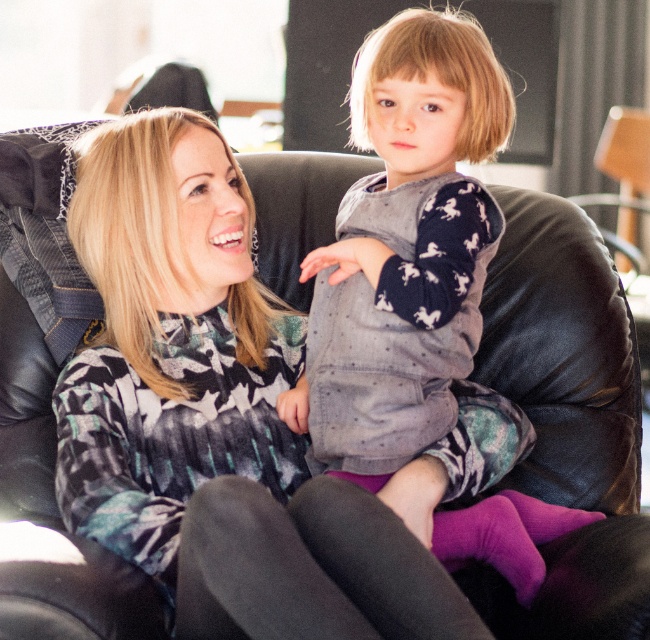
You are a fashion designer observing the scene. You need to decide which item of clothing is higher up on the person wearing them. Which one is higher between the knit sweater at center and the purple matte leggings at center?

The knit sweater at center is taller than the purple matte leggings at center, so the knit sweater at center is higher up on the person wearing them.

You are designing a clothing catalog and need to place the knit sweater at center and purple matte leggings at center next to each other. Based on their sizes, which one should you place first to ensure they fit well together?

The knit sweater at center has a larger size compared to purple matte leggings at center, so you should place the knit sweater at center first to accommodate its larger size before positioning the purple matte leggings at center.

You are a photographer setting up a shot of the scene. You want to focus on the knit sweater at center and the purple matte leggings at center. Which one will appear closer to the camera in the photo?

The knit sweater at center will appear closer to the camera because it is further to the viewer than the purple matte leggings at center.